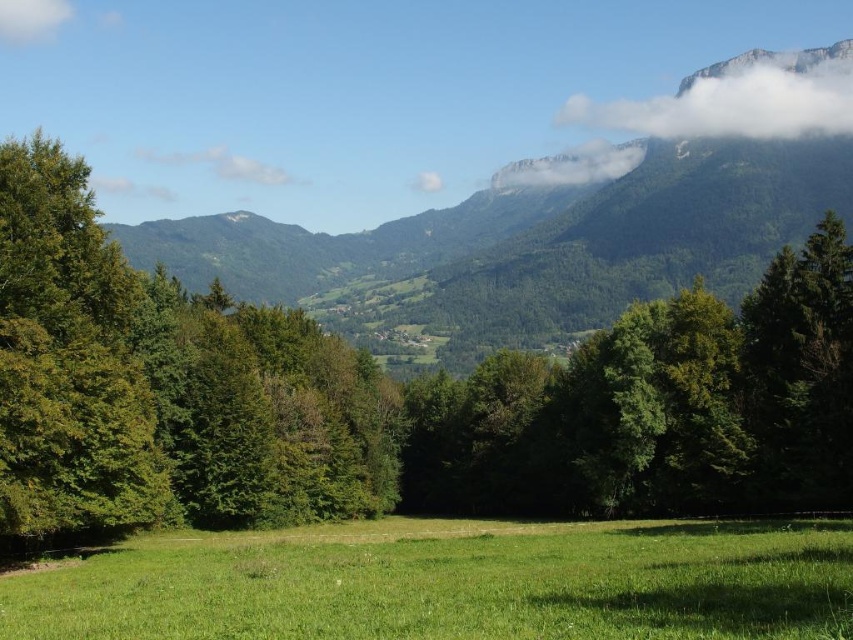
Question: Which point is closer to the camera?

Choices:
 (A) white fluffy cloud at upper left
 (B) green grassy field at center
 (C) white fluffy cloud at upper right

Answer: (B)

Question: In this image, where is green leafy tree at center located relative to white fluffy cloud at upper right?

Choices:
 (A) left
 (B) right

Answer: (A)

Question: Which point is farther from the camera taking this photo?

Choices:
 (A) (576, 390)
 (B) (9, 227)

Answer: (A)

Question: Is green leafy tree at center positioned at the back of green grassy field at center?

Choices:
 (A) yes
 (B) no

Answer: (A)

Question: Which of these objects is positioned farthest from the green leafy tree at center?

Choices:
 (A) green grassy field at center
 (B) white fluffy cloud at upper center

Answer: (B)

Question: Can you confirm if green grassy field at center is positioned above white fluffy cloud at upper right?

Choices:
 (A) no
 (B) yes

Answer: (A)